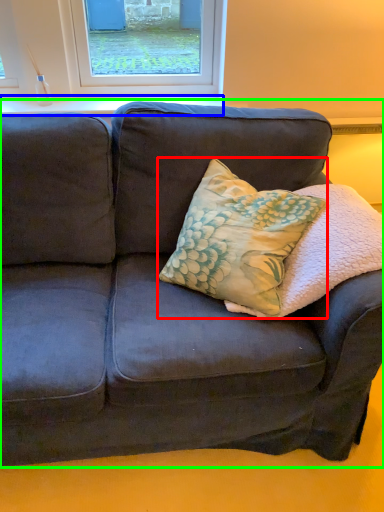
Question: Which is nearer to the throw pillow (highlighted by a red box)? window sill (highlighted by a blue box) or studio couch (highlighted by a green box).

Choices:
 (A) window sill
 (B) studio couch

Answer: (B)